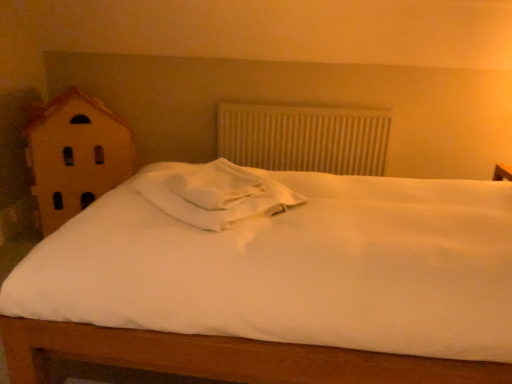
At what (x,y) coordinates should I click in order to perform the action: click on blank space situated above white textured radiator at center (from a real-world perspective). Please return your answer as a coordinate pair (x, y). The width and height of the screenshot is (512, 384). Looking at the image, I should click on (317, 107).